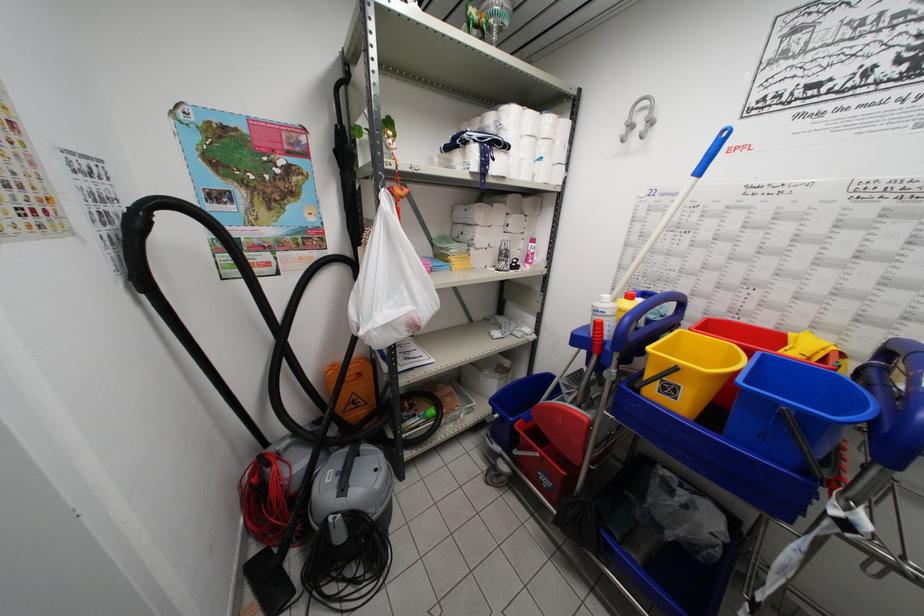
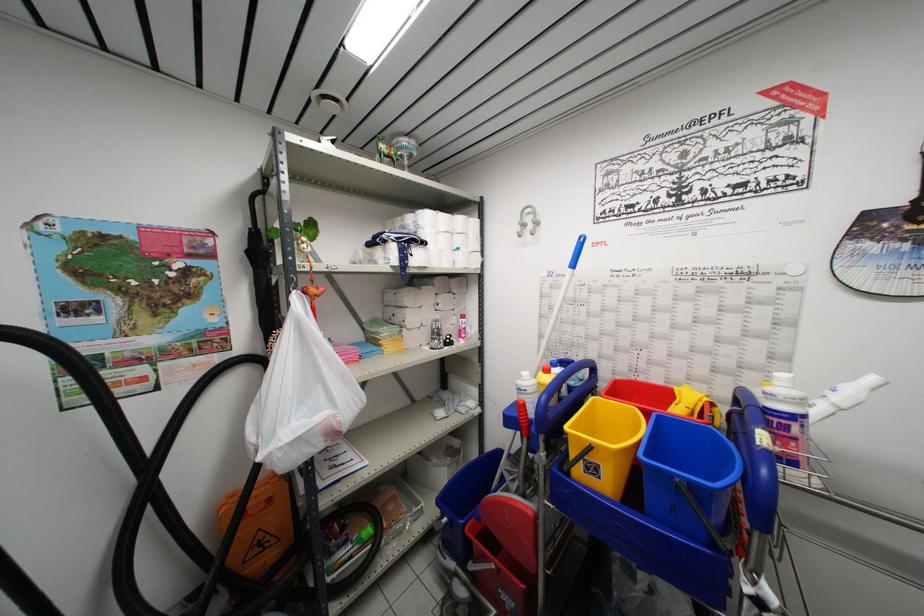
In the second image, find the point that corresponds to (x=528, y=114) in the first image.

(441, 217)